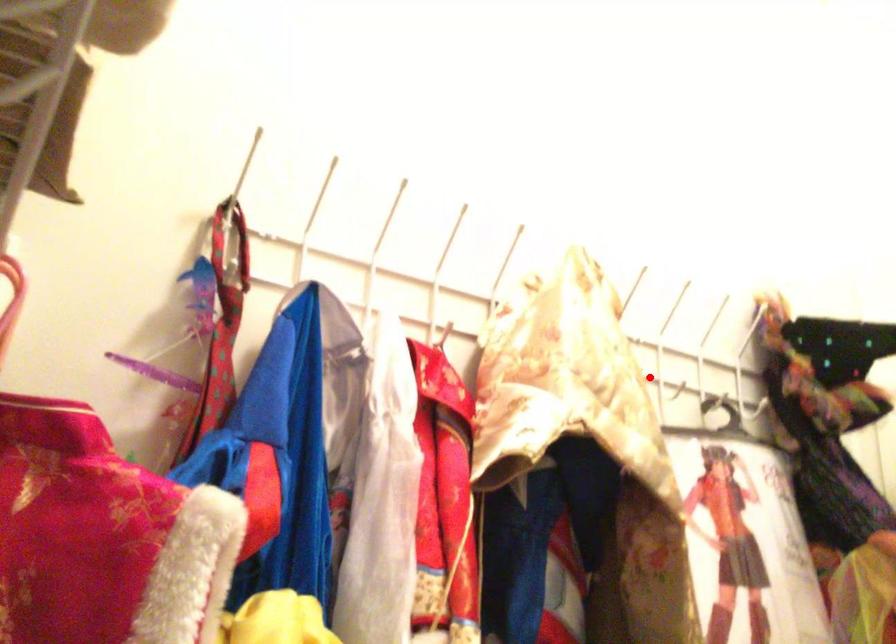
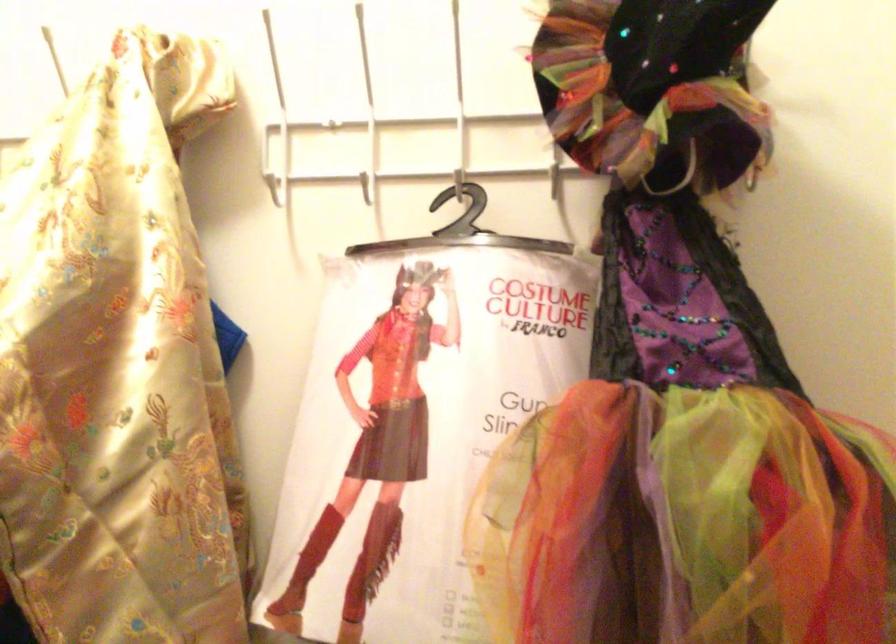
Question: I am providing you with two images of the same scene from different viewpoints. In image1, a red point is highlighted. Considering the same 3D point in image2, which of the following is correct?

Choices:
 (A) It is closer
 (B) It is farther

Answer: (A)